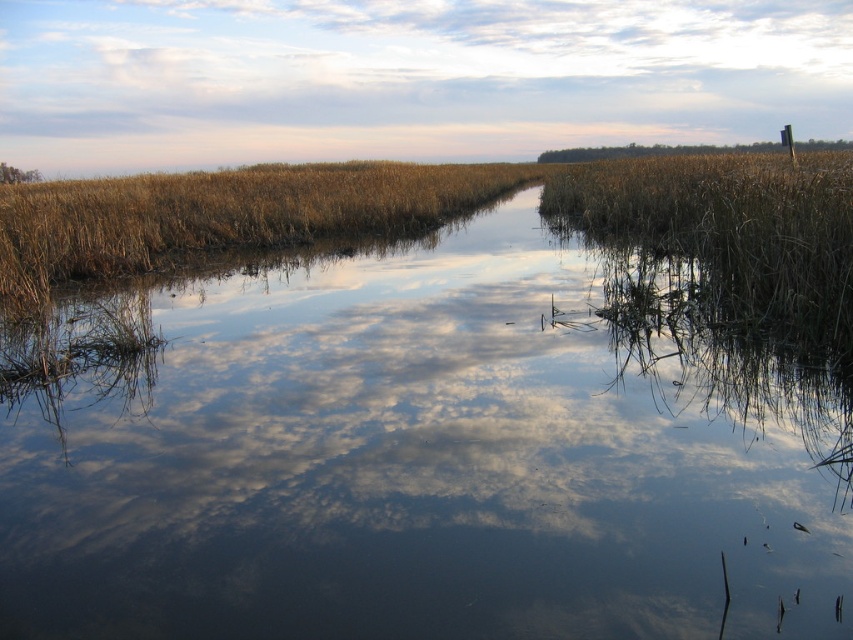
Question: Can you confirm if brown grassy stream at center is positioned above cloudy sky at upper center?

Choices:
 (A) no
 (B) yes

Answer: (A)

Question: Is brown grassy stream at center smaller than cloudy sky at upper center?

Choices:
 (A) yes
 (B) no

Answer: (A)

Question: Which point appears farthest from the camera in this image?

Choices:
 (A) (357, 148)
 (B) (770, 362)

Answer: (A)

Question: Which object appears farthest from the camera in this image?

Choices:
 (A) cloudy sky at upper center
 (B) brown grassy stream at center

Answer: (A)

Question: Is brown grassy stream at center further to camera compared to cloudy sky at upper center?

Choices:
 (A) no
 (B) yes

Answer: (A)

Question: Which of the following is the closest to the observer?

Choices:
 (A) (74, 499)
 (B) (167, 145)

Answer: (A)